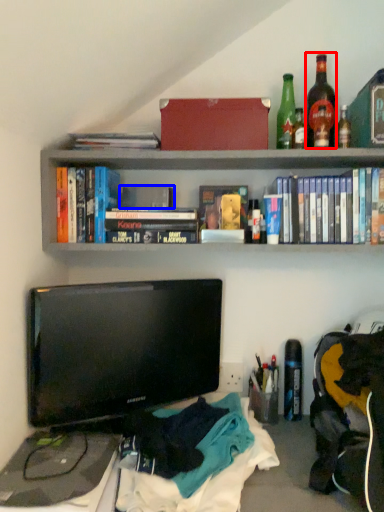
Question: Which of the following is the closest to the observer, bottle (highlighted by a red box) or paperback book (highlighted by a blue box)?

Choices:
 (A) bottle
 (B) paperback book

Answer: (A)